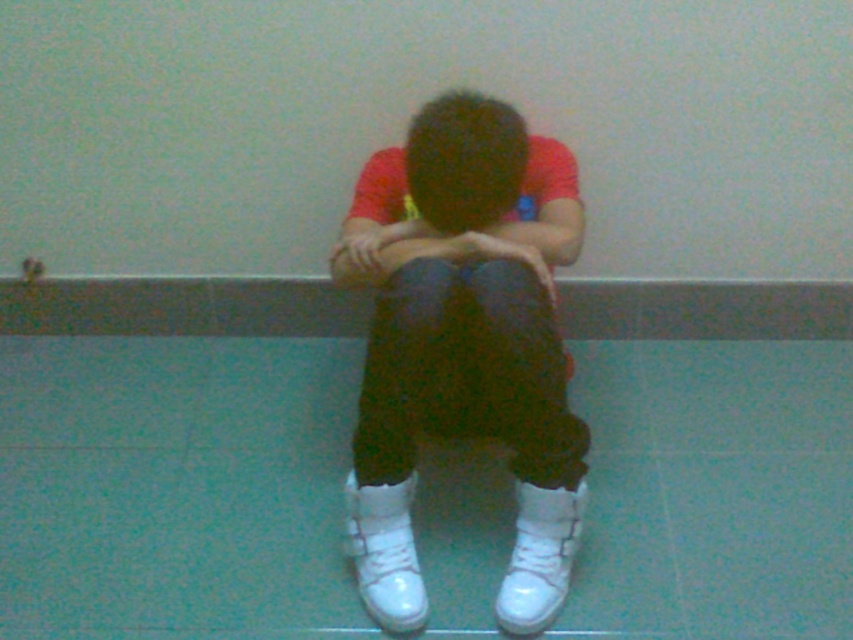
Question: From the image, what is the correct spatial relationship of dark brown hair at center in relation to matte white hand at center?

Choices:
 (A) right
 (B) left

Answer: (A)

Question: Which is nearer to the white leather shoes at center?

Choices:
 (A) matte white hand at center
 (B) dark brown hair at center

Answer: (B)

Question: Is dark brown hair at center above matte white hand at center?

Choices:
 (A) no
 (B) yes

Answer: (B)

Question: Which object appears closest to the camera in this image?

Choices:
 (A) dark brown hair at center
 (B) matte white hand at center
 (C) white leather shoes at center

Answer: (C)

Question: Based on their relative distances, which object is nearer to the matte white hand at center?

Choices:
 (A) dark brown hair at center
 (B) white leather shoes at center

Answer: (A)

Question: Can you confirm if white leather shoes at center is positioned to the left of dark brown hair at center?

Choices:
 (A) no
 (B) yes

Answer: (B)